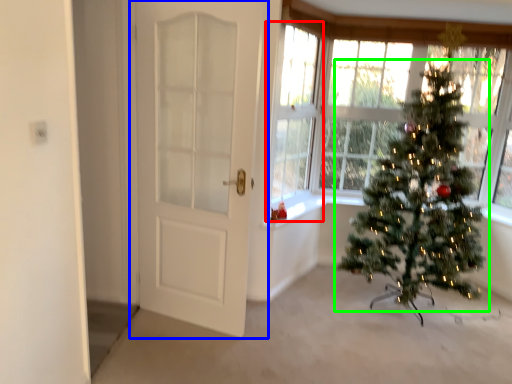
Question: Which object is positioned farthest from window (highlighted by a red box)? Select from door (highlighted by a blue box) and christmas tree (highlighted by a green box).

Choices:
 (A) door
 (B) christmas tree

Answer: (B)